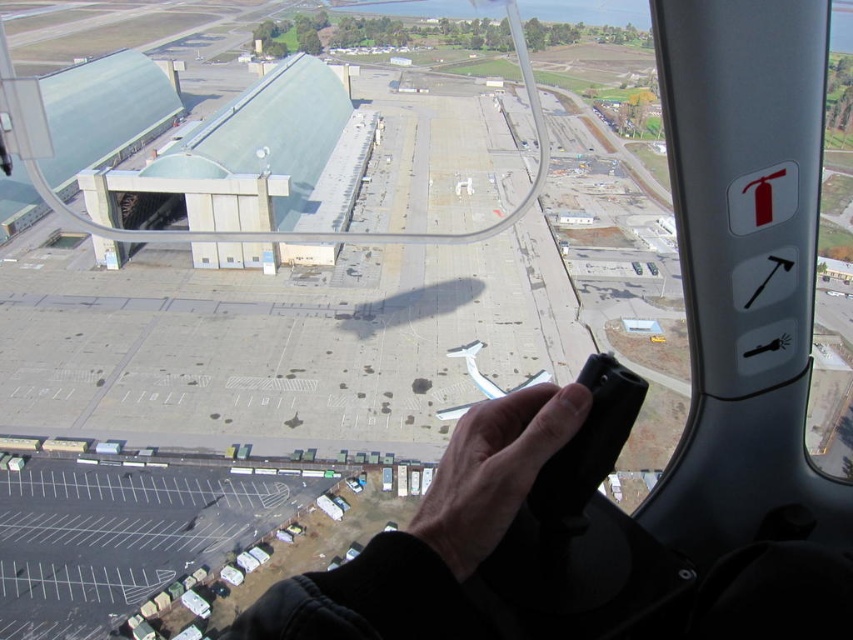
Does black matte remote control at center have a larger size compared to light skin tone hand at center?

Actually, black matte remote control at center might be smaller than light skin tone hand at center.

From the picture: Measure the distance between point (451, 561) and camera.

The distance of point (451, 561) from camera is 6.25 meters.

Locate an element on the screen. This screenshot has width=853, height=640. black matte remote control at center is located at coordinates (492, 470).